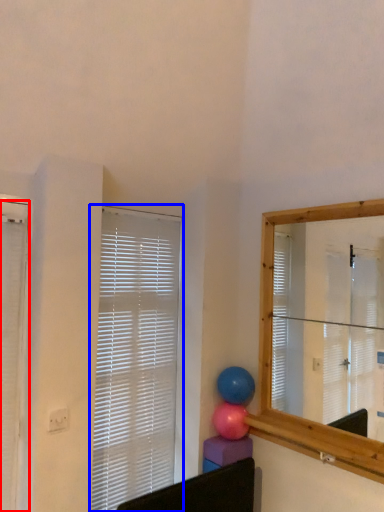
Question: Which object is closer to the camera taking this photo, window blind (highlighted by a red box) or window blind (highlighted by a blue box)?

Choices:
 (A) window blind
 (B) window blind

Answer: (A)